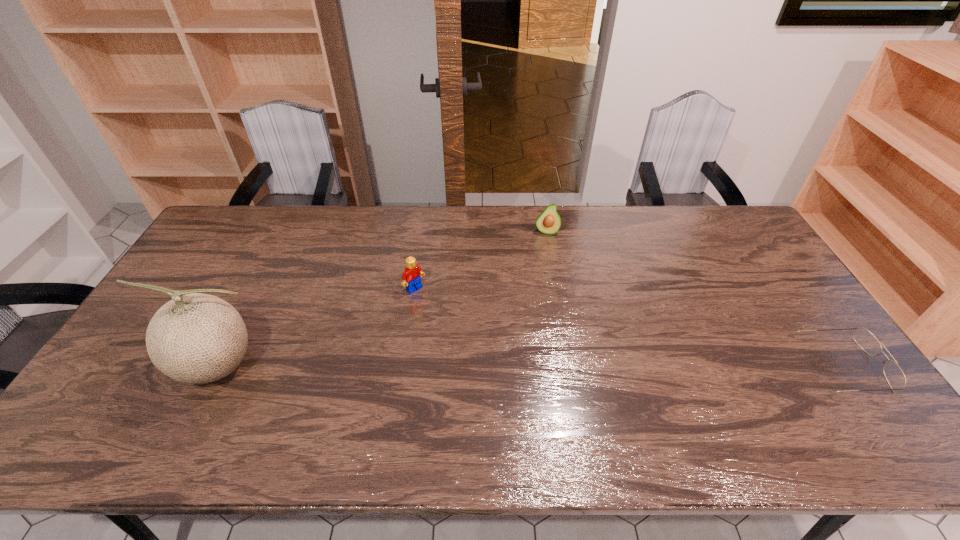
Find the location of a particular element. free space located 0.340m on the front-facing side of the Lego is located at coordinates (499, 361).

Image resolution: width=960 pixels, height=540 pixels. I want to click on vacant space located on the front-facing side of the Lego, so click(x=489, y=352).

Identify the location of vacant space situated 0.390m on the cut side of the third object from left to right. Image resolution: width=960 pixels, height=540 pixels. (543, 320).

Where is `vacant region located on the cut side of the third object from left to right`? This screenshot has height=540, width=960. vacant region located on the cut side of the third object from left to right is located at coordinates (545, 249).

You are a GUI agent. You are given a task and a screenshot of the screen. Output one action in this format:
    pyautogui.click(x=<x>, y=<y>)
    Task: Click on the free space located on the cut side of the third object from left to right
    The width and height of the screenshot is (960, 540).
    Given the screenshot: What is the action you would take?
    pyautogui.click(x=545, y=271)

Where is `object present at the far edge`? object present at the far edge is located at coordinates (549, 221).

Locate an element on the screen. cantaloup present at the near edge is located at coordinates (197, 338).

Locate an element on the screen. spectacles present at the near edge is located at coordinates (895, 377).

Find the location of a particular element. Image resolution: width=960 pixels, height=540 pixels. object that is at the left edge is located at coordinates (197, 338).

In order to click on object at the right edge in this screenshot , I will do `click(895, 377)`.